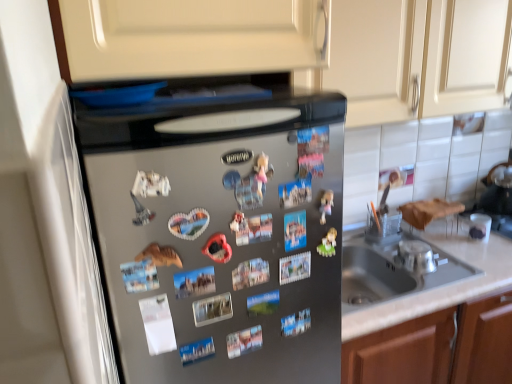
Question: Is matte plastic toy at center further to the viewer compared to matte cream cabinet at upper center?

Choices:
 (A) yes
 (B) no

Answer: (B)

Question: From the image's perspective, is matte plastic toy at center under matte cream cabinet at upper center?

Choices:
 (A) no
 (B) yes

Answer: (B)

Question: Considering the relative sizes of matte plastic toy at center and matte cream cabinet at upper center in the image provided, is matte plastic toy at center taller than matte cream cabinet at upper center?

Choices:
 (A) no
 (B) yes

Answer: (A)

Question: Is matte plastic toy at center positioned beyond the bounds of matte cream cabinet at upper center?

Choices:
 (A) yes
 (B) no

Answer: (A)

Question: Can you confirm if matte plastic toy at center is positioned to the left of matte cream cabinet at upper center?

Choices:
 (A) yes
 (B) no

Answer: (A)

Question: Is matte plastic toy at center bigger or smaller than satin silver refrigerator at center?

Choices:
 (A) small
 (B) big

Answer: (A)

Question: Is matte plastic toy at center wider or thinner than satin silver refrigerator at center?

Choices:
 (A) wide
 (B) thin

Answer: (B)

Question: From a real-world perspective, is matte plastic toy at center above or below satin silver refrigerator at center?

Choices:
 (A) below
 (B) above

Answer: (B)

Question: From their relative heights in the image, would you say matte plastic toy at center is taller or shorter than satin silver refrigerator at center?

Choices:
 (A) tall
 (B) short

Answer: (B)

Question: Is matte cream cabinet at upper center situated inside satin silver refrigerator at center or outside?

Choices:
 (A) inside
 (B) outside

Answer: (B)

Question: Considering the positions of matte cream cabinet at upper center and satin silver refrigerator at center in the image, is matte cream cabinet at upper center wider or thinner than satin silver refrigerator at center?

Choices:
 (A) wide
 (B) thin

Answer: (B)

Question: In terms of height, does matte cream cabinet at upper center look taller or shorter compared to satin silver refrigerator at center?

Choices:
 (A) tall
 (B) short

Answer: (B)

Question: Considering the relative positions of matte cream cabinet at upper center and satin silver refrigerator at center in the image provided, is matte cream cabinet at upper center to the left or to the right of satin silver refrigerator at center?

Choices:
 (A) left
 (B) right

Answer: (B)

Question: Is silver metallic bowl at sink wider or thinner than matte cream cabinet at upper center?

Choices:
 (A) thin
 (B) wide

Answer: (A)

Question: From the image's perspective, relative to matte cream cabinet at upper center, is silver metallic bowl at sink above or below?

Choices:
 (A) below
 (B) above

Answer: (A)